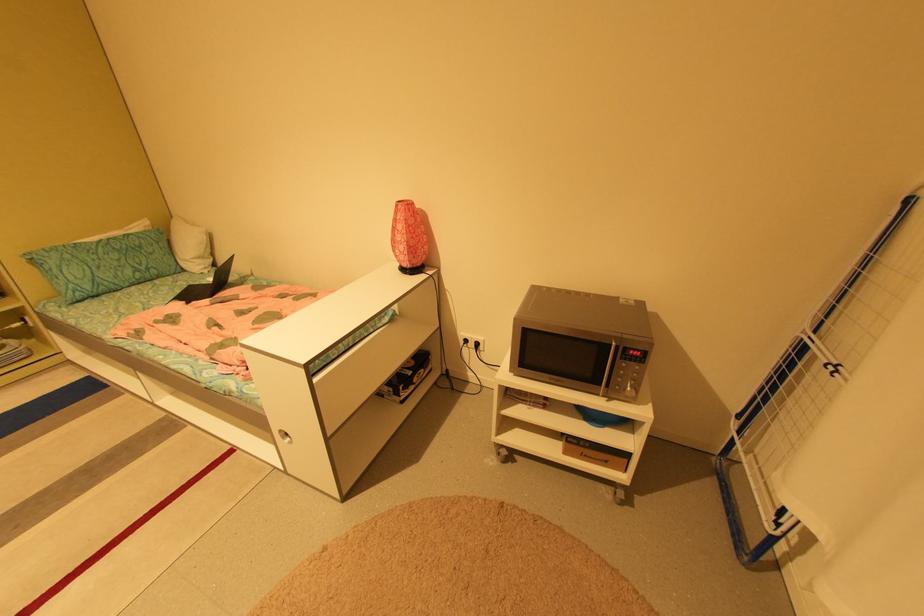
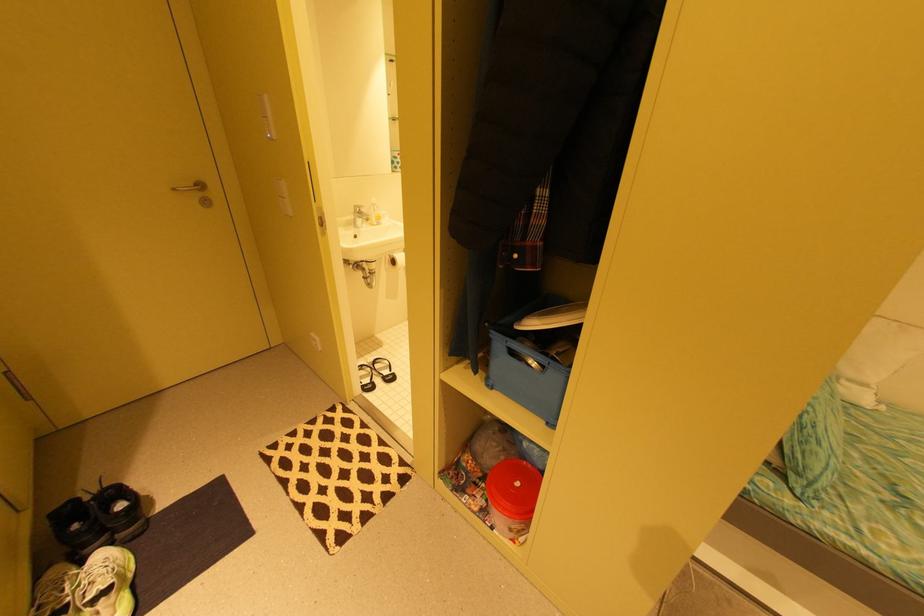
Question: The images are taken continuously from a first-person perspective. In which direction are you moving?

Choices:
 (A) Left
 (B) Right
 (C) Forward
 (D) Backward

Answer: (A)